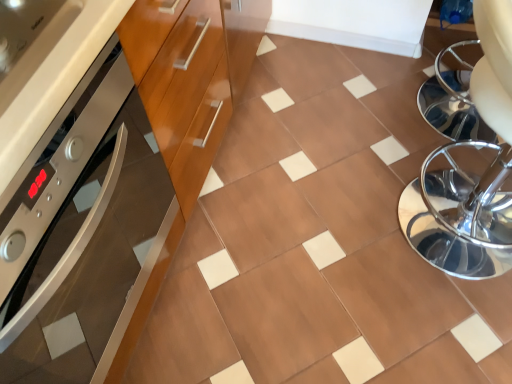
Question: Considering the positions of polished chrome swivel chair at right and wooden cabinet at left in the image, is polished chrome swivel chair at right wider or thinner than wooden cabinet at left?

Choices:
 (A) thin
 (B) wide

Answer: (A)

Question: In terms of size, does polished chrome swivel chair at right appear bigger or smaller than wooden cabinet at left?

Choices:
 (A) big
 (B) small

Answer: (B)

Question: Estimate the real-world distances between objects in this image. Which object is farther from the wooden cabinet at left?

Choices:
 (A) polished chrome swivel chair at right
 (B) brown glossy tile at center

Answer: (A)

Question: Which object is the closest to the wooden cabinet at left?

Choices:
 (A) polished chrome swivel chair at right
 (B) brown glossy tile at center

Answer: (B)